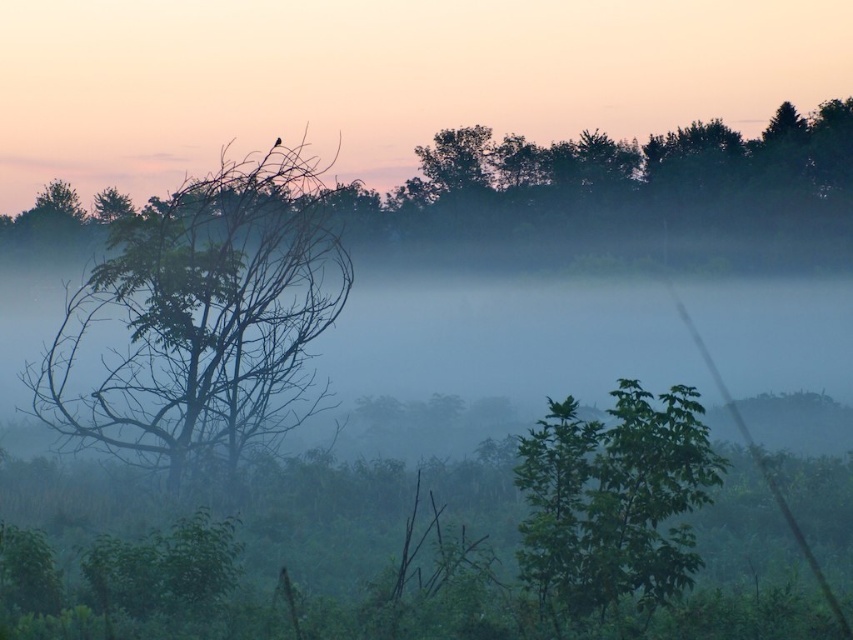
You are an ornithologist observing birds in the misty landscape. You notice a bird perched on the silhouetted tree at left and want to compare its size to the branches of the green leafy tree at upper center. Which tree has wider branches?

The silhouetted tree at left has wider branches than the green leafy tree at upper center because its width surpasses the latter.

You are standing in the misty landscape and want to move from the point closer to you to the farther point. Which path would you take between the two points, point (758,179) and point (271,144)?

You should take the path from point (758,179) to point (271,144) since point (758,179) is closer to the viewer and you want to move to the farther point.

Looking at this image, you are an ornithologist observing this landscape. You notice a bird perched on the green matte tree at left and want to compare its size to the green leafy tree at upper center. Which tree is larger?

The green leafy tree at upper center is larger than the green matte tree at left.